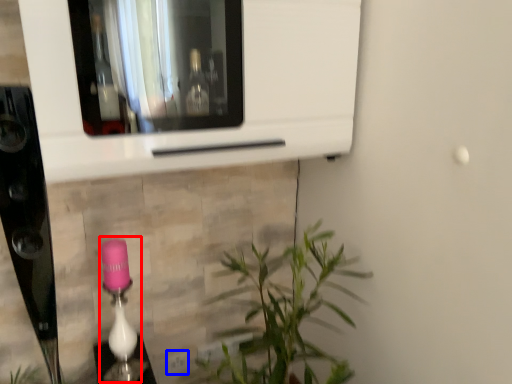
Question: Which point is closer to the camera, lamp (highlighted by a red box) or electric outlet (highlighted by a blue box)?

Choices:
 (A) lamp
 (B) electric outlet

Answer: (A)